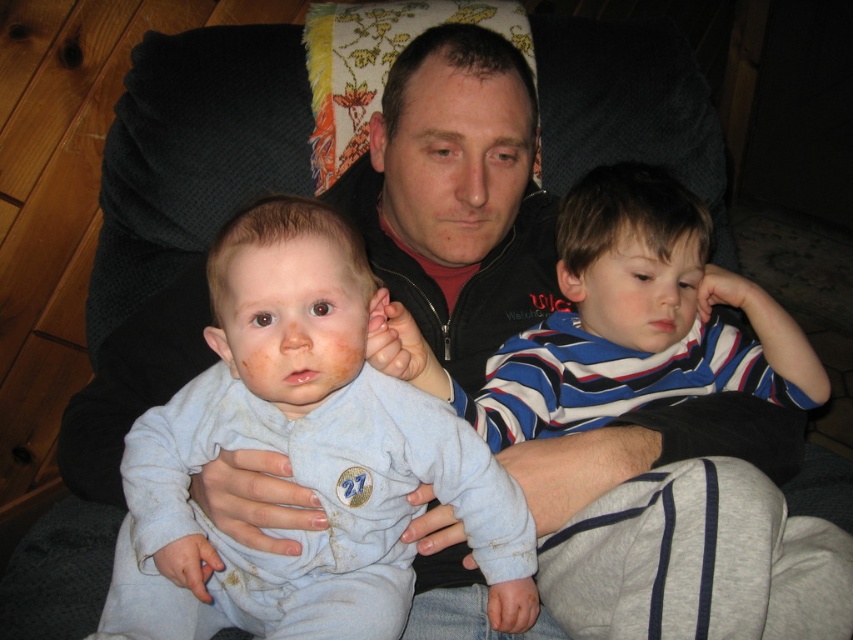
You are a photographer trying to capture a candid shot of the striped cotton shirt at center and the light blue soft fabric baby at center. If your camera has a depth of field that can focus on objects within 20 centimeters of each other, will both subjects be in focus?

The striped cotton shirt at center is 18.92 centimeters from the light blue soft fabric baby at center. Since the distance between them is less than 20 centimeters, both subjects will be within the camera focus range and thus in focus.

In the scene described, there is a striped cotton shirt at center and a light blue soft fabric baby at center. From the perspective of someone sitting on the couch, which object is positioned to the right?

The striped cotton shirt at center is to the right of the light blue soft fabric baby at center.